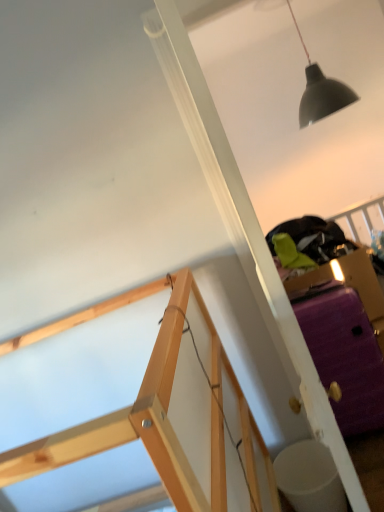
Describe the element at coordinates (117, 424) in the screenshot. I see `natural wood ladder at upper center` at that location.

This screenshot has height=512, width=384. Identify the location of natural wood ladder at upper center. (117, 424).

Locate an element on the screen. Image resolution: width=384 pixels, height=512 pixels. natural wood ladder at upper center is located at coordinates (117, 424).